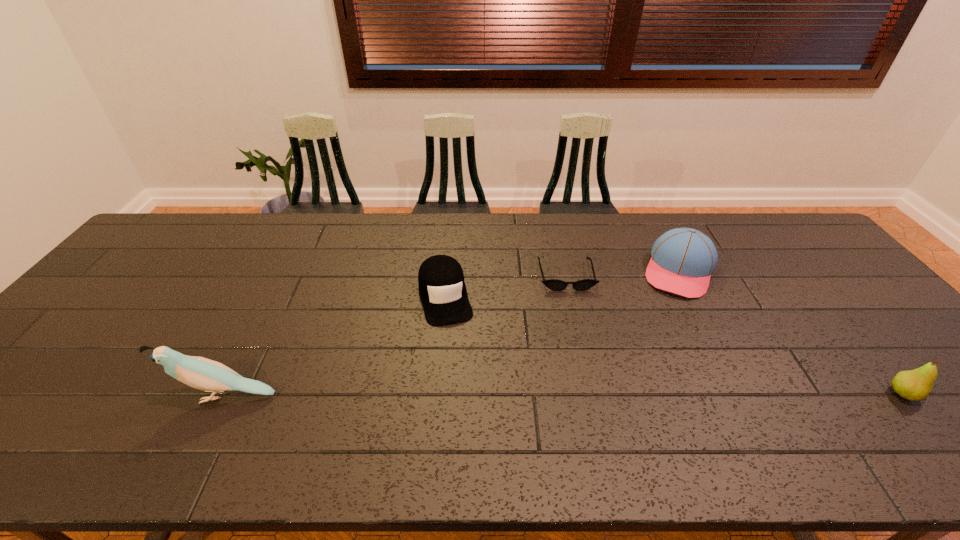
I want to click on vacant area situated 0.170m on the front-facing side of the cap, so click(x=463, y=377).

This screenshot has width=960, height=540. I want to click on object that is positioned at the far edge, so click(x=682, y=261).

What are the coordinates of `bird located in the near edge section of the desktop` in the screenshot? It's located at (201, 373).

Locate an element on the screen. The image size is (960, 540). pear that is at the near edge is located at coordinates (916, 385).

This screenshot has height=540, width=960. In order to click on object that is at the right edge in this screenshot , I will do `click(916, 385)`.

Find the location of `object present at the near right corner`. object present at the near right corner is located at coordinates (916, 385).

The image size is (960, 540). In the image, there is a desktop. Identify the location of vacant space at the far edge. (381, 253).

The image size is (960, 540). Find the location of `free space at the near edge of the desktop`. free space at the near edge of the desktop is located at coordinates (137, 421).

Where is `free region at the left edge of the desktop`? free region at the left edge of the desktop is located at coordinates (102, 355).

Find the location of `vacant space at the far left corner of the desktop`. vacant space at the far left corner of the desktop is located at coordinates (156, 253).